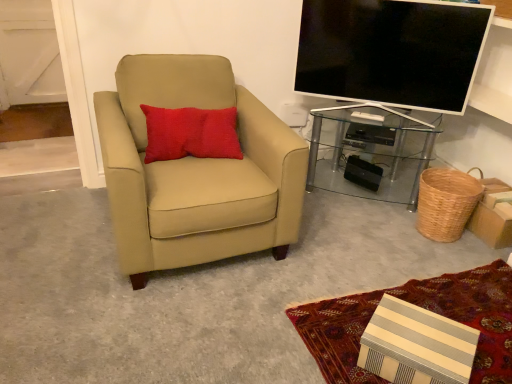
Question: From a real-world perspective, is woven brown basket at lower right beneath red textured pillow at upper left?

Choices:
 (A) no
 (B) yes

Answer: (B)

Question: Considering the relative positions of woven brown basket at lower right and red textured pillow at upper left in the image provided, is woven brown basket at lower right to the left of red textured pillow at upper left from the viewer's perspective?

Choices:
 (A) yes
 (B) no

Answer: (B)

Question: Could red textured pillow at upper left be considered to be inside woven brown basket at lower right?

Choices:
 (A) no
 (B) yes

Answer: (A)

Question: Can we say woven brown basket at lower right lies outside red textured pillow at upper left?

Choices:
 (A) yes
 (B) no

Answer: (A)

Question: Is woven brown basket at lower right turned away from red textured pillow at upper left?

Choices:
 (A) yes
 (B) no

Answer: (B)

Question: Considering the relative positions of transparent glass desk at right and beige leather chair at left in the image provided, is transparent glass desk at right to the left or to the right of beige leather chair at left?

Choices:
 (A) left
 (B) right

Answer: (B)

Question: Considering the positions of transparent glass desk at right and beige leather chair at left in the image, is transparent glass desk at right wider or thinner than beige leather chair at left?

Choices:
 (A) thin
 (B) wide

Answer: (A)

Question: Is transparent glass desk at right taller or shorter than beige leather chair at left?

Choices:
 (A) tall
 (B) short

Answer: (B)

Question: In terms of size, does transparent glass desk at right appear bigger or smaller than beige leather chair at left?

Choices:
 (A) small
 (B) big

Answer: (A)

Question: In the image, is matte black tv at upper right positioned in front of or behind woven brown basket at lower right?

Choices:
 (A) behind
 (B) front

Answer: (B)

Question: Considering the positions of point (483, 4) and point (453, 180), is point (483, 4) closer or farther from the camera than point (453, 180)?

Choices:
 (A) closer
 (B) farther

Answer: (A)

Question: Is matte black tv at upper right taller or shorter than woven brown basket at lower right?

Choices:
 (A) short
 (B) tall

Answer: (B)

Question: In terms of width, does matte black tv at upper right look wider or thinner when compared to woven brown basket at lower right?

Choices:
 (A) thin
 (B) wide

Answer: (A)

Question: In terms of height, does red textured pillow at upper left look taller or shorter compared to matte black tv at upper right?

Choices:
 (A) tall
 (B) short

Answer: (B)

Question: Is red textured pillow at upper left bigger or smaller than matte black tv at upper right?

Choices:
 (A) small
 (B) big

Answer: (A)